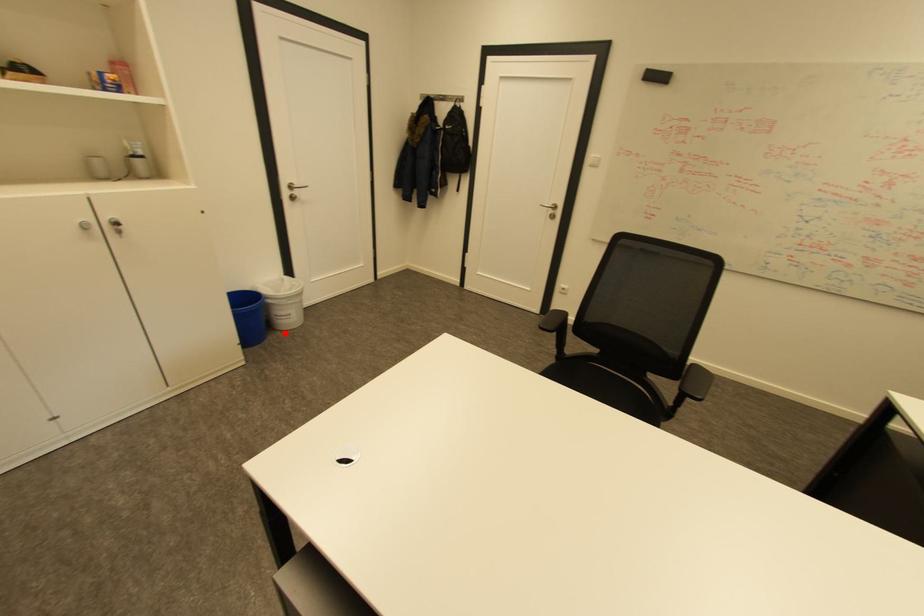
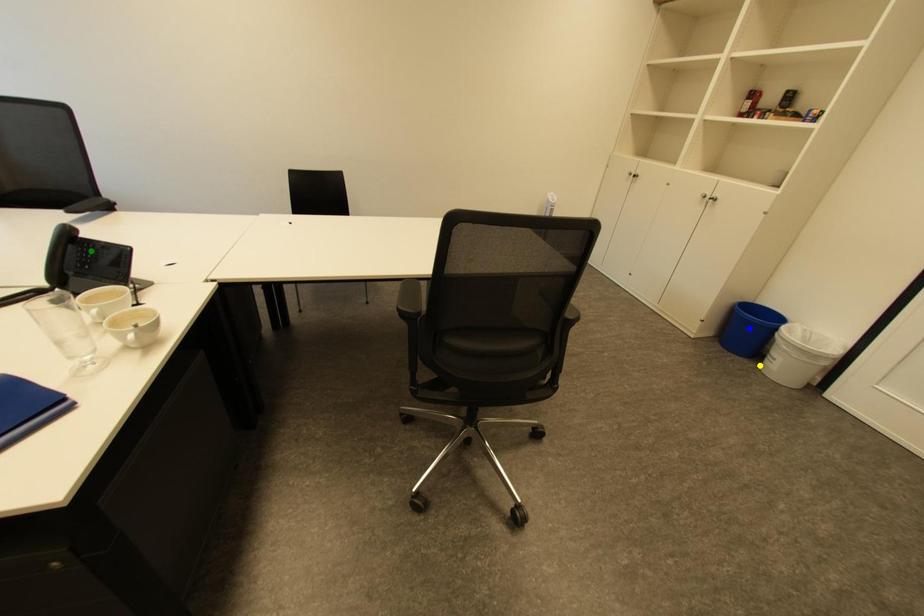
Question: I am providing you with two images of the same scene from different viewpoints. A red point is marked on the first image. You are given multiple points on the second image. Which spot in image 2 lines up with the point in image 1?

Choices:
 (A) yellow point
 (B) green point
 (C) blue point

Answer: (A)